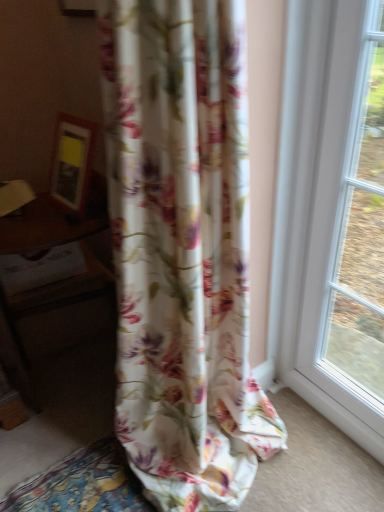
Image resolution: width=384 pixels, height=512 pixels. Describe the element at coordinates (52, 294) in the screenshot. I see `wooden table at left` at that location.

Where is `wooden table at left`? wooden table at left is located at coordinates (52, 294).

The height and width of the screenshot is (512, 384). Describe the element at coordinates (182, 249) in the screenshot. I see `floral fabric curtain at center` at that location.

Locate an element on the screen. This screenshot has width=384, height=512. floral fabric curtain at center is located at coordinates (182, 249).

The image size is (384, 512). I want to click on wooden table at left, so click(52, 294).

In the image, is floral fabric curtain at center on the left side or the right side of wooden table at left?

floral fabric curtain at center is to the right of wooden table at left.

Which object is more forward, floral fabric curtain at center or wooden table at left?

floral fabric curtain at center is in front.

Which is in front, point (130, 385) or point (107, 303)?

The point (130, 385) is closer.

From the image's perspective, is floral fabric curtain at center positioned above or below wooden table at left?

Based on their image positions, floral fabric curtain at center is located above wooden table at left.

Based on the photo, from a real-world perspective, who is located higher, floral fabric curtain at center or wooden table at left?

floral fabric curtain at center, from a real-world perspective.

Considering the relative sizes of floral fabric curtain at center and wooden table at left in the image provided, is floral fabric curtain at center thinner than wooden table at left?

No, floral fabric curtain at center is not thinner than wooden table at left.

Based on the photo, considering the sizes of objects floral fabric curtain at center and wooden table at left in the image provided, who is taller, floral fabric curtain at center or wooden table at left?

With more height is floral fabric curtain at center.

Based on the photo, considering the relative sizes of floral fabric curtain at center and wooden table at left in the image provided, is floral fabric curtain at center smaller than wooden table at left?

No.

Is floral fabric curtain at center not inside wooden table at left?

floral fabric curtain at center is positioned outside wooden table at left.

Is the surface of floral fabric curtain at center in direct contact with wooden table at left?

floral fabric curtain at center and wooden table at left are not in contact.

Is floral fabric curtain at center aimed at wooden table at left?

No, floral fabric curtain at center is not oriented towards wooden table at left.

Can you tell me how much floral fabric curtain at center and wooden table at left differ in facing direction?

They differ by 77.2 degrees in their facing directions.

At what (x,y) coordinates should I click in order to perform the action: click on curtain on the right of wooden table at left. Please return your answer as a coordinate pair (x, y). Looking at the image, I should click on (182, 249).

Can you confirm if wooden table at left is positioned to the left of floral fabric curtain at center?

Correct, you'll find wooden table at left to the left of floral fabric curtain at center.

Consider the image. Is wooden table at left further to camera compared to floral fabric curtain at center?

Yes, wooden table at left is further from the viewer.

Does point (50, 346) come in front of point (246, 236)?

No, it is behind (246, 236).

Looking at this image, from the image's perspective, which one is positioned lower, wooden table at left or floral fabric curtain at center?

wooden table at left.

From a real-world perspective, is wooden table at left physically above floral fabric curtain at center?

Actually, wooden table at left is physically below floral fabric curtain at center in the real world.

Considering the sizes of objects wooden table at left and floral fabric curtain at center in the image provided, who is thinner, wooden table at left or floral fabric curtain at center?

With smaller width is wooden table at left.

Considering the relative sizes of wooden table at left and floral fabric curtain at center in the image provided, is wooden table at left taller than floral fabric curtain at center?

Incorrect, the height of wooden table at left is not larger of that of floral fabric curtain at center.

Who is bigger, wooden table at left or floral fabric curtain at center?

floral fabric curtain at center is bigger.

Is wooden table at left not inside floral fabric curtain at center?

Absolutely, wooden table at left is external to floral fabric curtain at center.

Is there a large distance between wooden table at left and floral fabric curtain at center?

No.

Is wooden table at left oriented away from floral fabric curtain at center?

wooden table at left is not turned away from floral fabric curtain at center.

Measure the distance from wooden table at left to floral fabric curtain at center.

A distance of 26.57 inches exists between wooden table at left and floral fabric curtain at center.

This screenshot has height=512, width=384. I want to click on curtain that is on the right side of wooden table at left, so click(182, 249).

You are a GUI agent. You are given a task and a screenshot of the screen. Output one action in this format:
    pyautogui.click(x=<x>, y=<y>)
    Task: Click on the curtain above the wooden table at left (from a real-world perspective)
    The width and height of the screenshot is (384, 512).
    Given the screenshot: What is the action you would take?
    pyautogui.click(x=182, y=249)

The width and height of the screenshot is (384, 512). Identify the location of table behind the floral fabric curtain at center. (52, 294).